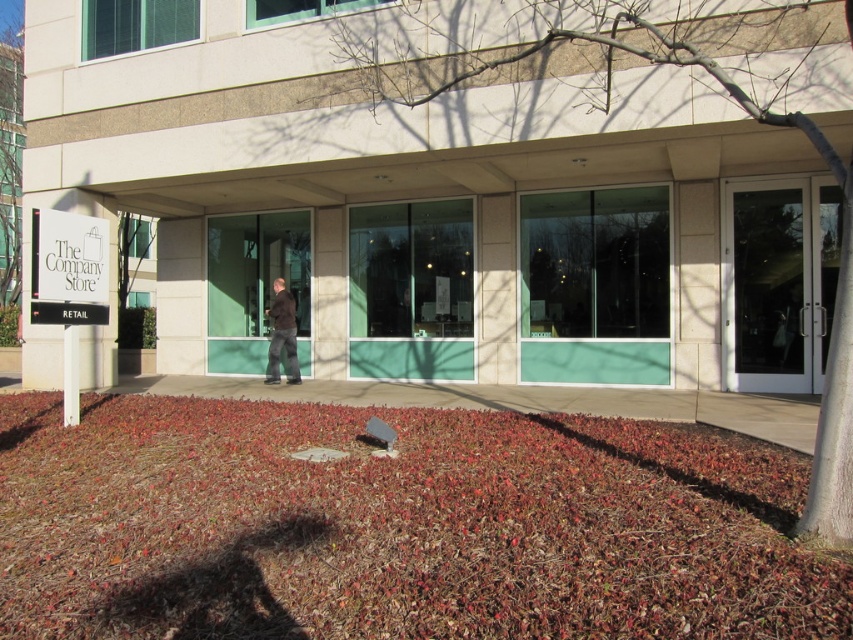
Question: Which point is farther to the camera?

Choices:
 (A) white glass door at right
 (B) dark brown jacket at center
 (C) white plastic sign at upper left

Answer: (B)

Question: Which of the following is the farthest from the observer?

Choices:
 (A) white glass door at right
 (B) white plastic sign at upper left
 (C) dark brown jacket at center

Answer: (C)

Question: Does white glass door at right appear over white plastic sign at upper left?

Choices:
 (A) no
 (B) yes

Answer: (A)

Question: Is white plastic sign at upper left positioned behind dark brown jacket at center?

Choices:
 (A) no
 (B) yes

Answer: (A)

Question: Is white glass door at right positioned before white plastic sign at upper left?

Choices:
 (A) no
 (B) yes

Answer: (A)

Question: Among these objects, which one is nearest to the camera?

Choices:
 (A) white glass door at right
 (B) dark brown jacket at center
 (C) white plastic sign at upper left

Answer: (C)